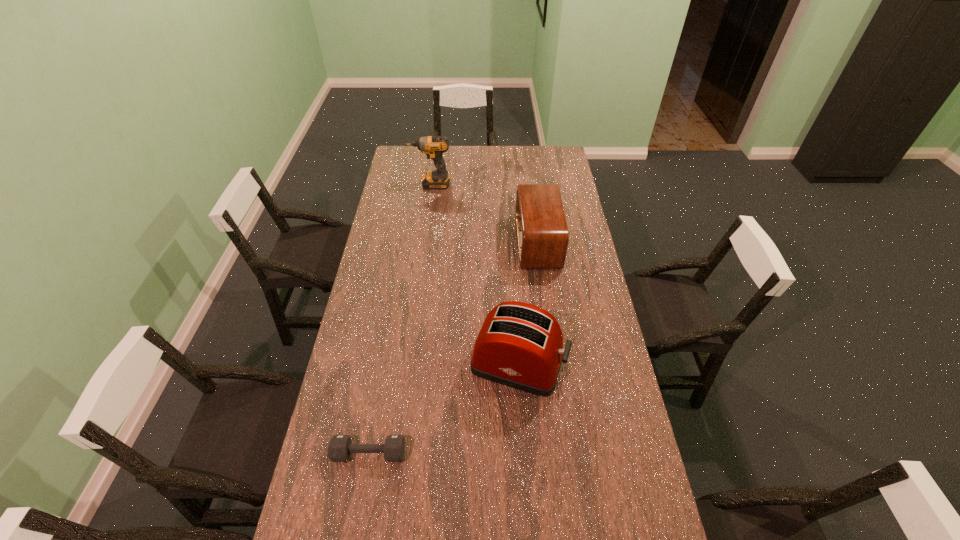
Where is `the farthest object`? The image size is (960, 540). the farthest object is located at coordinates (433, 146).

Locate an element on the screen. toaster is located at coordinates (520, 345).

You are a GUI agent. You are given a task and a screenshot of the screen. Output one action in this format:
    pyautogui.click(x=<x>, y=<y>)
    Task: Click on the second tallest object
    This screenshot has height=540, width=960.
    Given the screenshot: What is the action you would take?
    [x=520, y=345]

Where is `the second shortest object`? the second shortest object is located at coordinates (542, 234).

Find the location of a particular element. the second farthest object is located at coordinates (542, 234).

Image resolution: width=960 pixels, height=540 pixels. Find the location of `the shortest object`. the shortest object is located at coordinates (339, 449).

The height and width of the screenshot is (540, 960). I want to click on dumbbell, so click(x=339, y=449).

I want to click on free space located on the back of the third farthest object, so click(x=513, y=284).

Find the location of `free space located on the front panel of the third nearest object`. free space located on the front panel of the third nearest object is located at coordinates (467, 242).

Where is `vacant space located 0.350m on the front panel of the third nearest object`? vacant space located 0.350m on the front panel of the third nearest object is located at coordinates (437, 242).